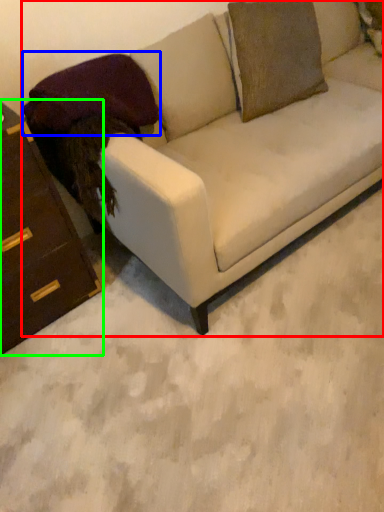
Question: Which is farther away from studio couch (highlighted by a red box)? pillow (highlighted by a blue box) or chest of drawers (highlighted by a green box)?

Choices:
 (A) pillow
 (B) chest of drawers

Answer: (B)